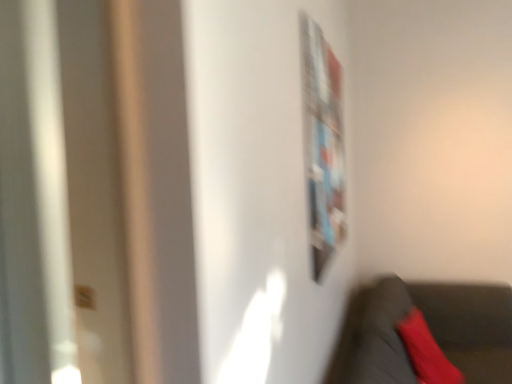
Question: Can you confirm if velvet red pillow at lower right is smaller than metallic silver bulletin board at upper right?

Choices:
 (A) no
 (B) yes

Answer: (A)

Question: Can you confirm if velvet red pillow at lower right is positioned to the left of metallic silver bulletin board at upper right?

Choices:
 (A) yes
 (B) no

Answer: (B)

Question: From a real-world perspective, is velvet red pillow at lower right positioned under metallic silver bulletin board at upper right based on gravity?

Choices:
 (A) no
 (B) yes

Answer: (B)

Question: Is velvet red pillow at lower right oriented away from metallic silver bulletin board at upper right?

Choices:
 (A) yes
 (B) no

Answer: (B)

Question: Can you confirm if velvet red pillow at lower right is wider than metallic silver bulletin board at upper right?

Choices:
 (A) no
 (B) yes

Answer: (B)

Question: Would you say velvet red pillow at lower right is to the left or to the right of velvet black chair at lower right in the picture?

Choices:
 (A) left
 (B) right

Answer: (A)

Question: From the image's perspective, is velvet red pillow at lower right positioned above or below velvet black chair at lower right?

Choices:
 (A) above
 (B) below

Answer: (A)

Question: Considering the positions of velvet red pillow at lower right and velvet black chair at lower right in the image, is velvet red pillow at lower right bigger or smaller than velvet black chair at lower right?

Choices:
 (A) big
 (B) small

Answer: (B)

Question: From a real-world perspective, is velvet red pillow at lower right above or below velvet black chair at lower right?

Choices:
 (A) below
 (B) above

Answer: (B)

Question: From a real-world perspective, is velvet black chair at lower right above or below velvet red pillow at lower right?

Choices:
 (A) above
 (B) below

Answer: (B)

Question: Relative to velvet red pillow at lower right, is velvet black chair at lower right in front or behind?

Choices:
 (A) behind
 (B) front

Answer: (B)

Question: Considering the positions of point (478, 319) and point (448, 372), is point (478, 319) closer or farther from the camera than point (448, 372)?

Choices:
 (A) closer
 (B) farther

Answer: (B)

Question: Would you say velvet black chair at lower right is inside or outside velvet red pillow at lower right?

Choices:
 (A) outside
 (B) inside

Answer: (A)

Question: Considering the positions of metallic silver bulletin board at upper right and velvet black chair at lower right in the image, is metallic silver bulletin board at upper right taller or shorter than velvet black chair at lower right?

Choices:
 (A) short
 (B) tall

Answer: (B)

Question: In terms of size, does metallic silver bulletin board at upper right appear bigger or smaller than velvet black chair at lower right?

Choices:
 (A) small
 (B) big

Answer: (A)